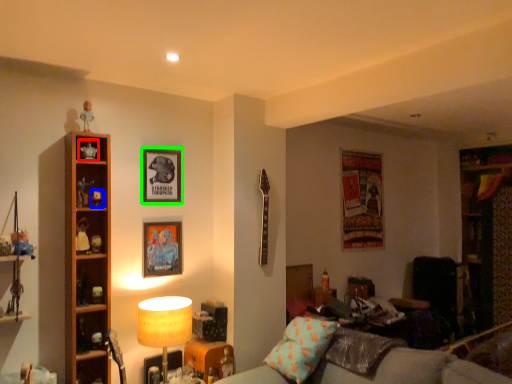
Question: Based on their relative distances, which object is nearer to toy (highlighted by a red box)? Choose from toy (highlighted by a blue box) and picture frame (highlighted by a green box).

Choices:
 (A) toy
 (B) picture frame

Answer: (A)